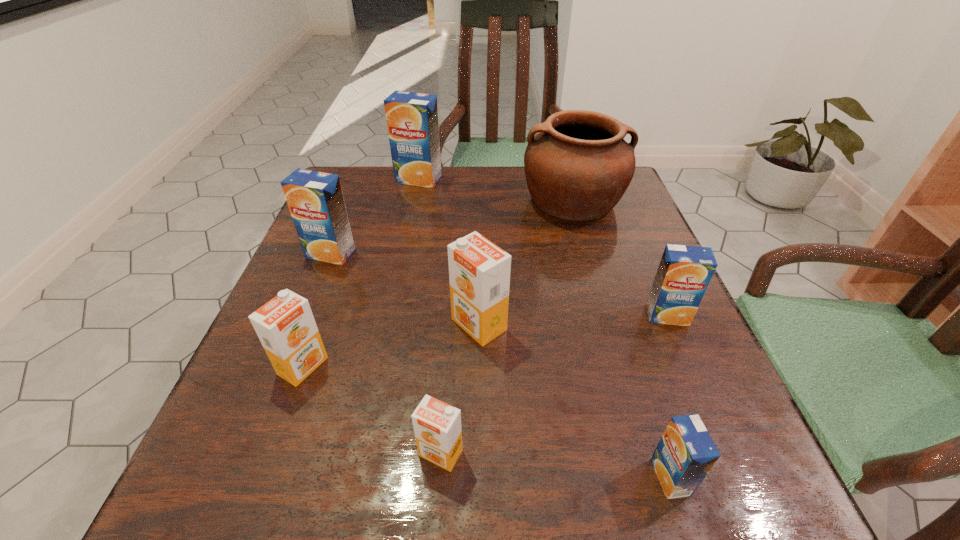
The height and width of the screenshot is (540, 960). Identify the location of empty location between the second smallest orange orange juice and the nearest orange orange juice. (372, 409).

Find the location of a particular element. the second closest object to the farthest blue orange_juice is located at coordinates (315, 199).

Point out which object is positioned as the fifth nearest to the leftmost orange orange juice. Please provide its 2D coordinates. Your answer should be formatted as a tuple, i.e. [(x, y)], where the tuple contains the x and y coordinates of a point satisfying the conditions above.

[(685, 454)]

Locate an element on the screen. The image size is (960, 540). orange juice that is the sixth closest to the leftmost orange orange juice is located at coordinates (684, 273).

Where is `orange juice that stands as the fifth closest to the rightmost blue orange_juice`? orange juice that stands as the fifth closest to the rightmost blue orange_juice is located at coordinates (315, 199).

This screenshot has height=540, width=960. What are the coordinates of `blue orange_juice that stands as the third closest to the second smallest orange orange juice` in the screenshot? It's located at (412, 118).

Locate an element on the screen. blue orange_juice that stands as the second closest to the smallest blue orange_juice is located at coordinates (315, 199).

Where is `orange orange juice identified as the closest to the smallest orange orange juice`? The height and width of the screenshot is (540, 960). orange orange juice identified as the closest to the smallest orange orange juice is located at coordinates (479, 271).

Choose which orange orange juice is the nearest neighbor to the biggest orange orange juice. Please provide its 2D coordinates. Your answer should be formatted as a tuple, i.e. [(x, y)], where the tuple contains the x and y coordinates of a point satisfying the conditions above.

[(437, 425)]

Find the location of `free location that satisfies the following two spatial constraints: 1. on the back side of the third biggest blue orange_juice; 2. on the right side of the nearest orange orange juice`. free location that satisfies the following two spatial constraints: 1. on the back side of the third biggest blue orange_juice; 2. on the right side of the nearest orange orange juice is located at coordinates (450, 315).